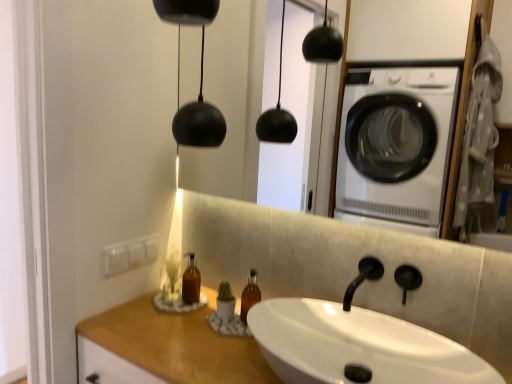
Question: From a real-world perspective, is translucent amber bottle at center physically located above or below wooden counter top at lower left?

Choices:
 (A) above
 (B) below

Answer: (A)

Question: Considering their positions, is translucent amber bottle at center located in front of or behind wooden counter top at lower left?

Choices:
 (A) front
 (B) behind

Answer: (B)

Question: Estimate the real-world distances between objects in this image. Which object is closer to the white glossy sink at center?

Choices:
 (A) black matte faucet at center
 (B) wooden counter top at lower left
 (C) translucent amber bottle at center

Answer: (A)

Question: Estimate the real-world distances between objects in this image. Which object is closer to the translucent amber bottle at center?

Choices:
 (A) white glossy sink at center
 (B) wooden counter top at lower left
 (C) black matte faucet at center

Answer: (B)